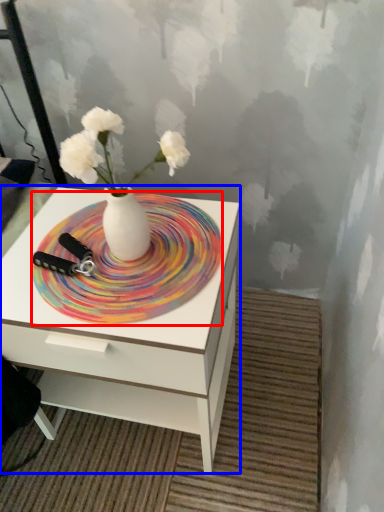
Question: Which object appears closest to the camera in this image, plate (highlighted by a red box) or nightstand (highlighted by a blue box)?

Choices:
 (A) plate
 (B) nightstand

Answer: (B)